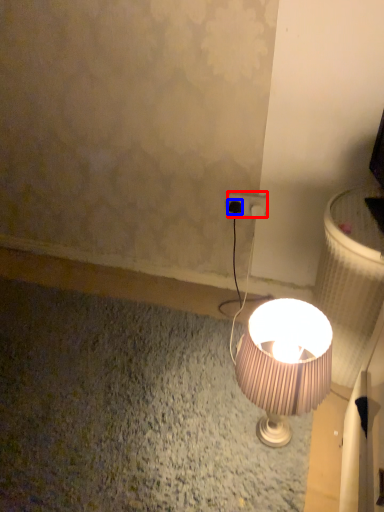
Question: Which object appears closest to the camera in this image, power plugs and sockets (highlighted by a red box) or plug (highlighted by a blue box)?

Choices:
 (A) power plugs and sockets
 (B) plug

Answer: (A)